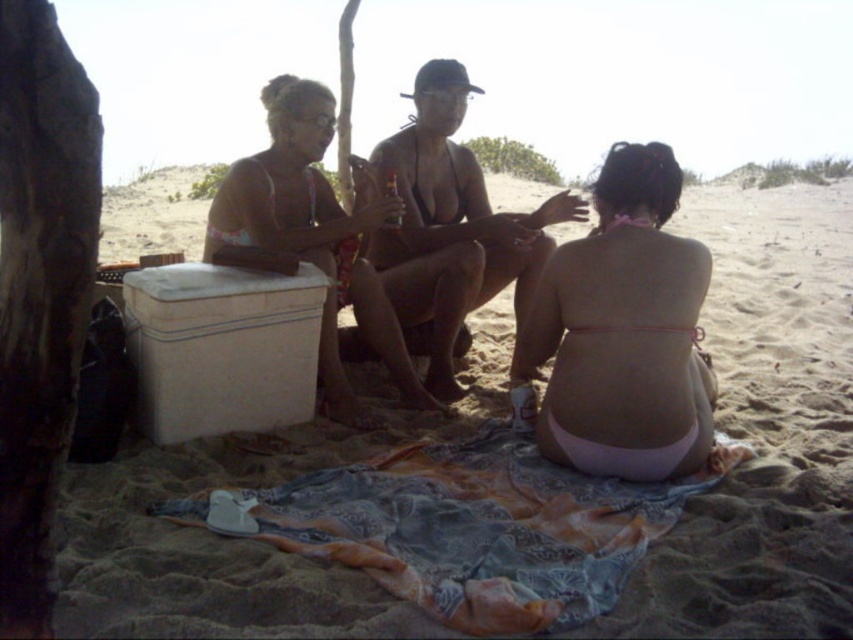
Can you confirm if pink fabric bikini at lower right is positioned to the left of matte black bikini at center?

No, pink fabric bikini at lower right is not to the left of matte black bikini at center.

Who is higher up, pink fabric bikini at lower right or matte black bikini at center?

Positioned higher is matte black bikini at center.

Which is behind, point (570, 380) or point (302, 184)?

Positioned behind is point (302, 184).

The height and width of the screenshot is (640, 853). What are the coordinates of `pink fabric bikini at lower right` in the screenshot? It's located at (624, 332).

Is white matte cooler at left below matte black bikini at center?

Yes.

Between white matte cooler at left and matte black bikini at center, which one has more height?

matte black bikini at center is taller.

What do you see at coordinates (221, 348) in the screenshot?
I see `white matte cooler at left` at bounding box center [221, 348].

Locate an element on the screen. This screenshot has width=853, height=640. white matte cooler at left is located at coordinates (221, 348).

Which is more to the right, printed cotton blanket at lower center or pink fabric bikini at lower right?

From the viewer's perspective, pink fabric bikini at lower right appears more on the right side.

Is printed cotton blanket at lower center to the left of pink fabric bikini at lower right from the viewer's perspective?

Correct, you'll find printed cotton blanket at lower center to the left of pink fabric bikini at lower right.

Is point (614, 531) closer to camera compared to point (682, 403)?

Yes, point (614, 531) is in front of point (682, 403).

Identify the location of printed cotton blanket at lower center. (467, 528).